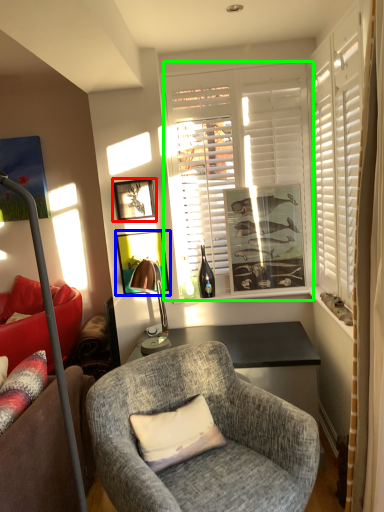
Question: Considering the real-world distances, which object is farthest from picture frame (highlighted by a red box)? picture frame (highlighted by a blue box) or window (highlighted by a green box)?

Choices:
 (A) picture frame
 (B) window

Answer: (B)